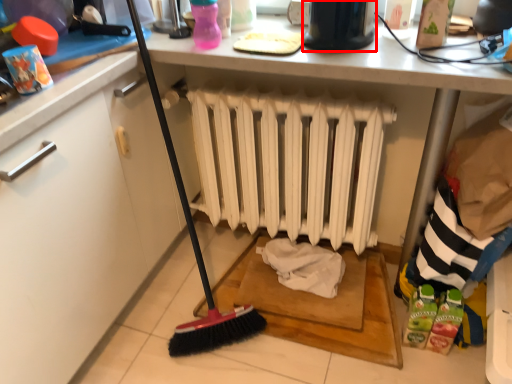
Question: From the image's perspective, what is the correct spatial positioning of appliance (annotated by the red box) in reference to radiator?

Choices:
 (A) below
 (B) above

Answer: (B)